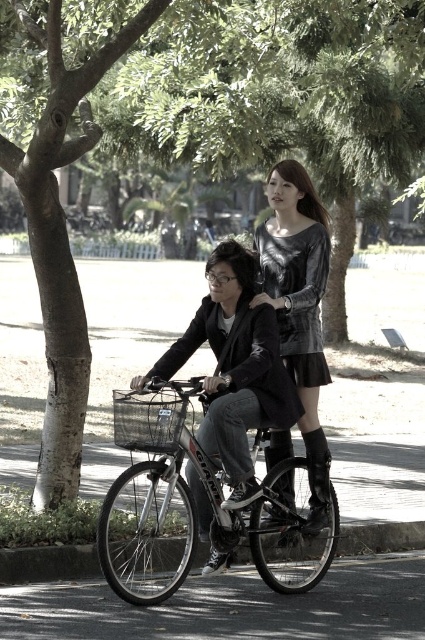
Is point (204, 492) positioned after point (167, 394)?

Yes, it is behind point (167, 394).

Between point (150, 369) and point (186, 412), which one is positioned behind?

The point (150, 369) is behind.

This screenshot has width=425, height=640. I want to click on shiny black dress at center, so click(x=235, y=368).

Who is shorter, silver metallic bicycle at center or velvet-like dress at center?

silver metallic bicycle at center

Find the location of a particular element. silver metallic bicycle at center is located at coordinates (186, 500).

Is point (308, 577) behind point (269, 177)?

That is False.

The height and width of the screenshot is (640, 425). I want to click on silver metallic bicycle at center, so click(x=186, y=500).

Based on the photo, does velvet-like dress at center have a larger size compared to black wire basket at center?

Yes.

Between point (299, 180) and point (144, 428), which one is positioned in front?

Point (144, 428) is more forward.

Locate an element on the screen. This screenshot has height=640, width=425. velvet-like dress at center is located at coordinates (299, 307).